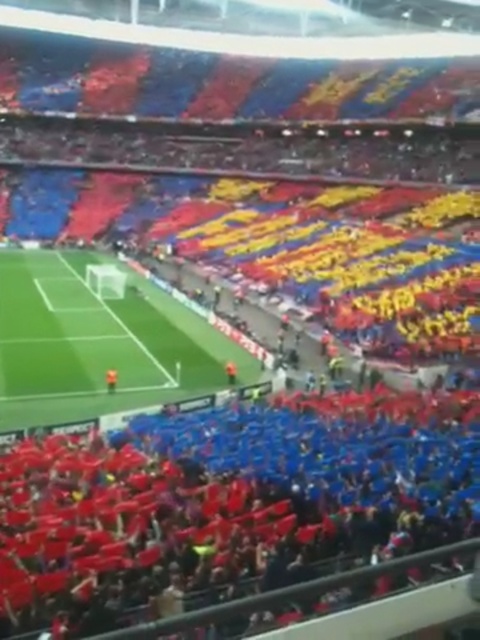
Is red fabric crowd at lower center above green grass football field at center?

Incorrect, red fabric crowd at lower center is not positioned above green grass football field at center.

Is point (427, 477) closer to camera compared to point (82, 394)?

Yes, point (427, 477) is in front of point (82, 394).

Does point (371, 547) come closer to viewer compared to point (72, 289)?

Yes.

The width and height of the screenshot is (480, 640). Find the location of `red fabric crowd at lower center`. red fabric crowd at lower center is located at coordinates pyautogui.click(x=225, y=502).